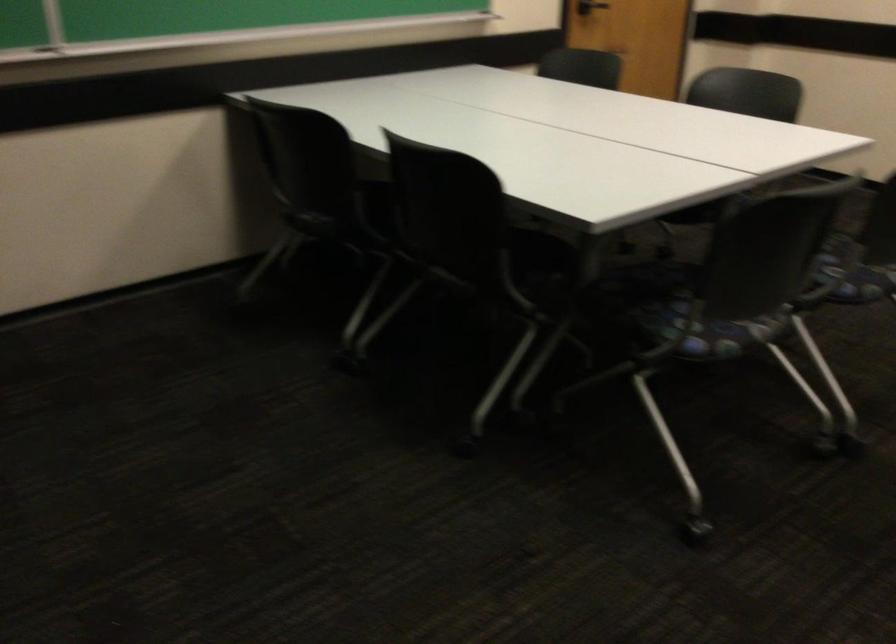
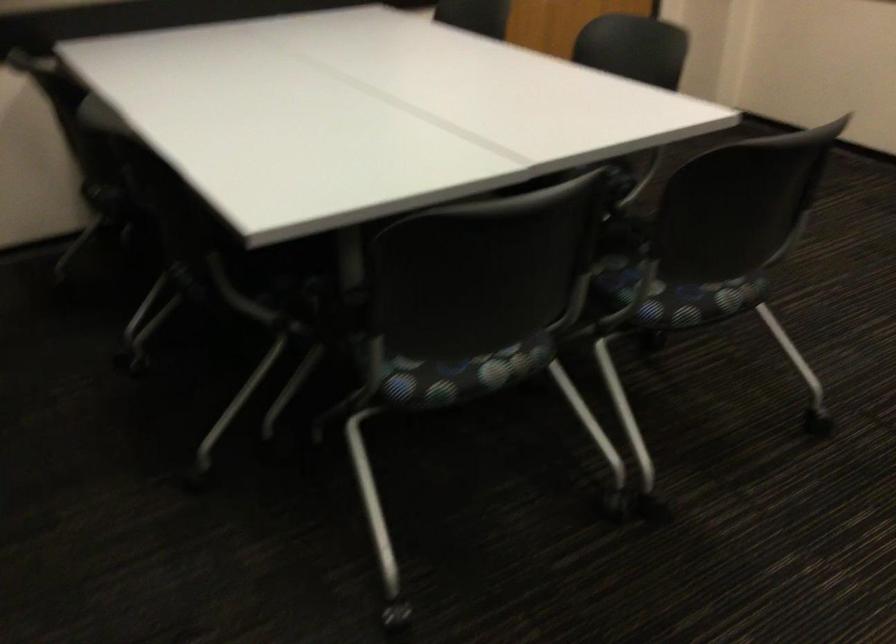
What movement of the cameraman would produce the second image?

The movement direction of the cameraman is right, forward.